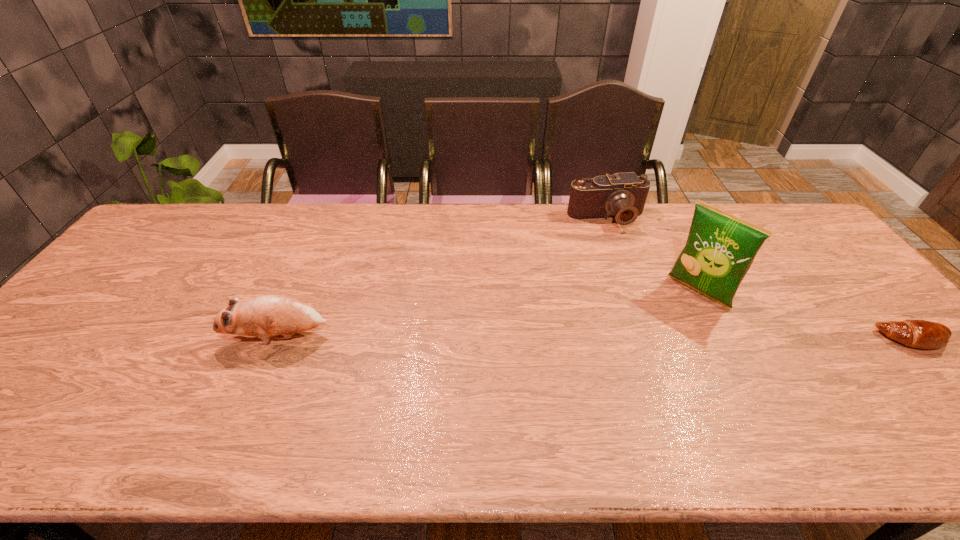
The height and width of the screenshot is (540, 960). What are the coordinates of `free space between the crisp (potato chip) and the leftmost object` in the screenshot? It's located at (488, 314).

Where is `vacant region between the farthest object and the hamster`? The height and width of the screenshot is (540, 960). vacant region between the farthest object and the hamster is located at coordinates (443, 278).

At what (x,y) coordinates should I click in order to perform the action: click on free space between the camera and the crisp (potato chip). Please return your answer as a coordinate pair (x, y). Looking at the image, I should click on (653, 255).

Choose which object is the second nearest neighbor to the crisp (potato chip). Please provide its 2D coordinates. Your answer should be formatted as a tuple, i.e. [(x, y)], where the tuple contains the x and y coordinates of a point satisfying the conditions above.

[(922, 334)]

Find the location of a particular element. The height and width of the screenshot is (540, 960). object that is the third closest to the farthest object is located at coordinates (273, 314).